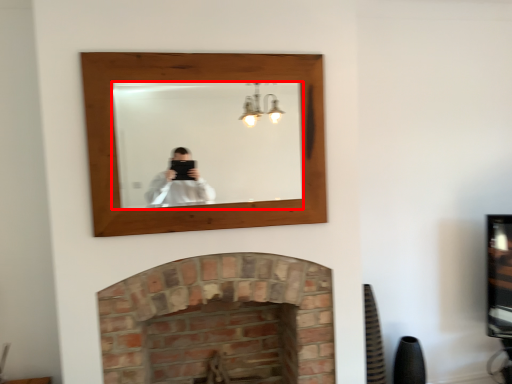
Question: From the image's perspective, what is the correct spatial relationship of mirror (annotated by the red box) in relation to fireplace?

Choices:
 (A) above
 (B) below

Answer: (A)